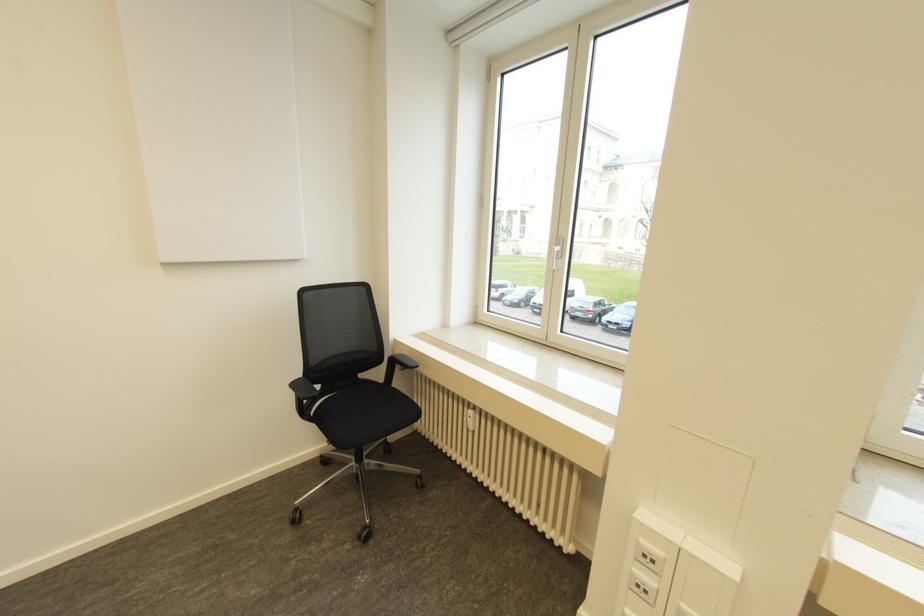
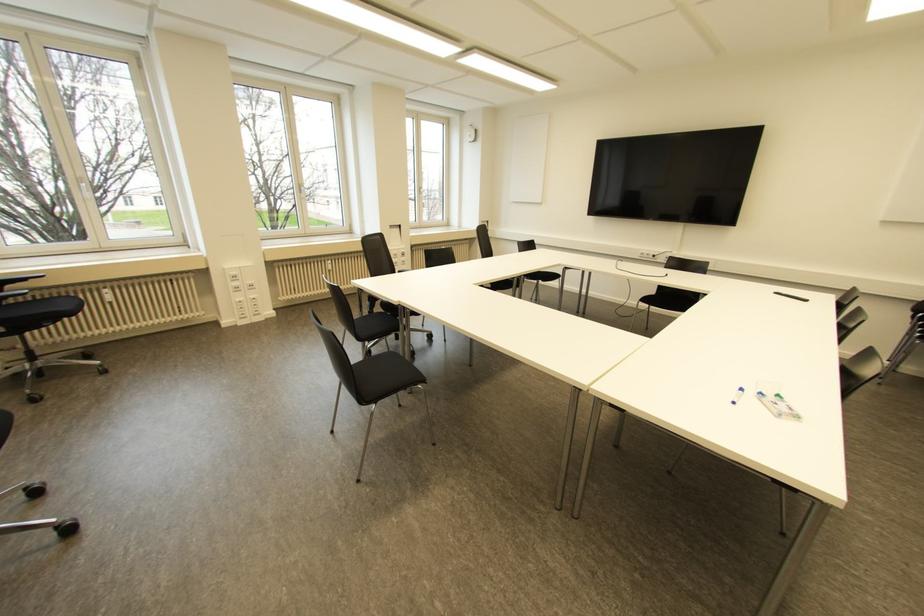
In the second image, find the point that corresponds to [649,545] in the first image.

(232, 273)